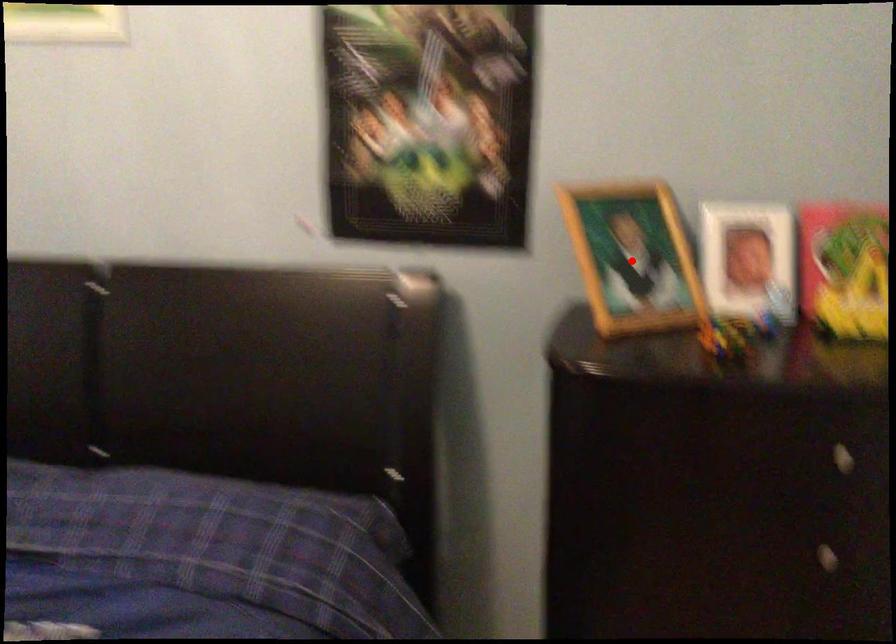
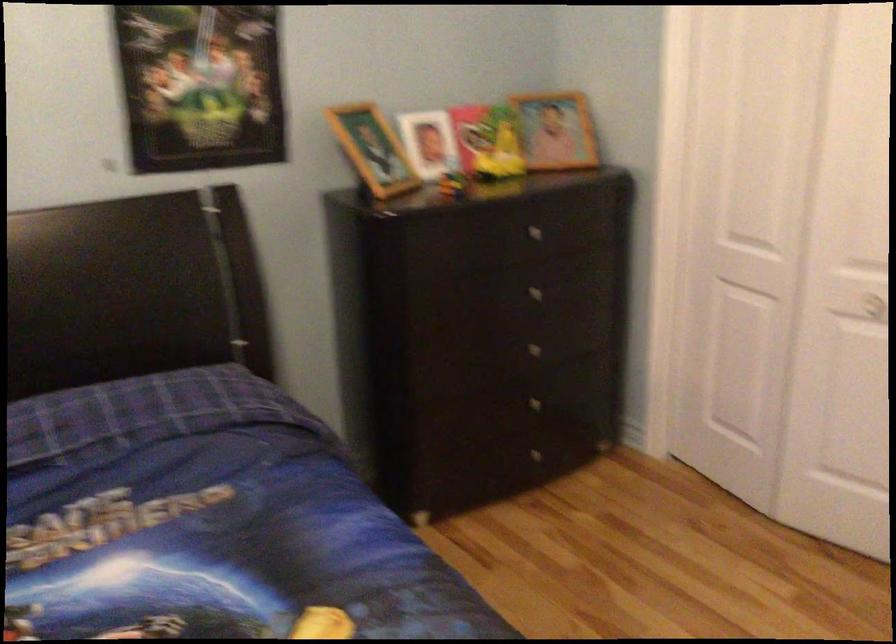
Question: I am providing you with two images of the same scene from different viewpoints. A red point is shown in image1. For the corresponding object point in image2, is it positioned nearer or farther from the camera?

Choices:
 (A) Nearer
 (B) Farther

Answer: (B)